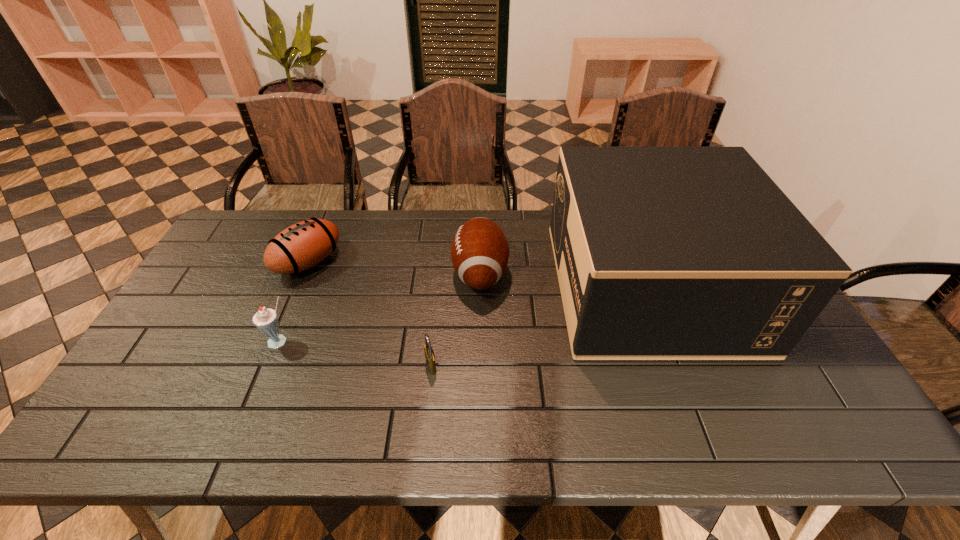
This screenshot has height=540, width=960. I want to click on vacant point located between the shortest object and the second object from right to left, so click(x=456, y=319).

Where is `free area in between the shorter football (American) and the milkshake`? free area in between the shorter football (American) and the milkshake is located at coordinates (295, 302).

This screenshot has width=960, height=540. Find the location of `vacant space that is in between the milkshake and the padlock`. vacant space that is in between the milkshake and the padlock is located at coordinates (356, 354).

This screenshot has height=540, width=960. In order to click on vacant point located between the right football (American) and the milkshake in this screenshot , I will do `click(380, 308)`.

The image size is (960, 540). I want to click on object identified as the third closest to the padlock, so click(x=266, y=320).

Locate which object is the closest to the rightmost object. Please provide its 2D coordinates. Your answer should be formatted as a tuple, i.e. [(x, y)], where the tuple contains the x and y coordinates of a point satisfying the conditions above.

[(479, 252)]

This screenshot has width=960, height=540. I want to click on vacant region that satisfies the following two spatial constraints: 1. on the front-facing side of the tallest object; 2. on the front side of the padlock, so click(681, 366).

Find the location of `free spot that satisfies the following two spatial constraints: 1. on the laces of the second object from right to left; 2. on the straw side of the milkshake`. free spot that satisfies the following two spatial constraints: 1. on the laces of the second object from right to left; 2. on the straw side of the milkshake is located at coordinates (480, 342).

The image size is (960, 540). What are the coordinates of `vacant space that satisfies the following two spatial constraints: 1. on the front-facing side of the rightmost object; 2. on the straw side of the milkshake` in the screenshot? It's located at (672, 342).

You are a GUI agent. You are given a task and a screenshot of the screen. Output one action in this format:
    pyautogui.click(x=<x>, y=<y>)
    Task: Click on the vacant space that satisfies the following two spatial constraints: 1. on the laces of the second object from right to left; 2. on the straw side of the milkshake
    This screenshot has height=540, width=960.
    Given the screenshot: What is the action you would take?
    pyautogui.click(x=480, y=342)